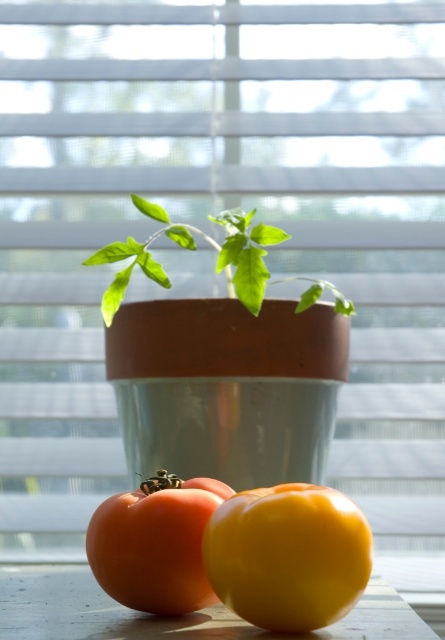
Question: Does shiny red tomato at lower left appear on the right side of green matte plant at center?

Choices:
 (A) yes
 (B) no

Answer: (B)

Question: Does yellow matte bell pepper at lower center appear over smooth wooden table at lower center?

Choices:
 (A) yes
 (B) no

Answer: (A)

Question: Where is smooth wooden table at lower center located in relation to shiny red tomato at lower left in the image?

Choices:
 (A) below
 (B) above

Answer: (A)

Question: Considering the real-world distances, which object is farthest from the yellow matte bell pepper at lower center?

Choices:
 (A) green matte plant at center
 (B) shiny red tomato at lower left

Answer: (A)

Question: Which is farther from the green matte plant at center?

Choices:
 (A) smooth wooden table at lower center
 (B) shiny red tomato at lower left
 (C) yellow matte bell pepper at lower center

Answer: (C)

Question: Which point is closer to the camera taking this photo?

Choices:
 (A) (109, 321)
 (B) (158, 538)

Answer: (B)